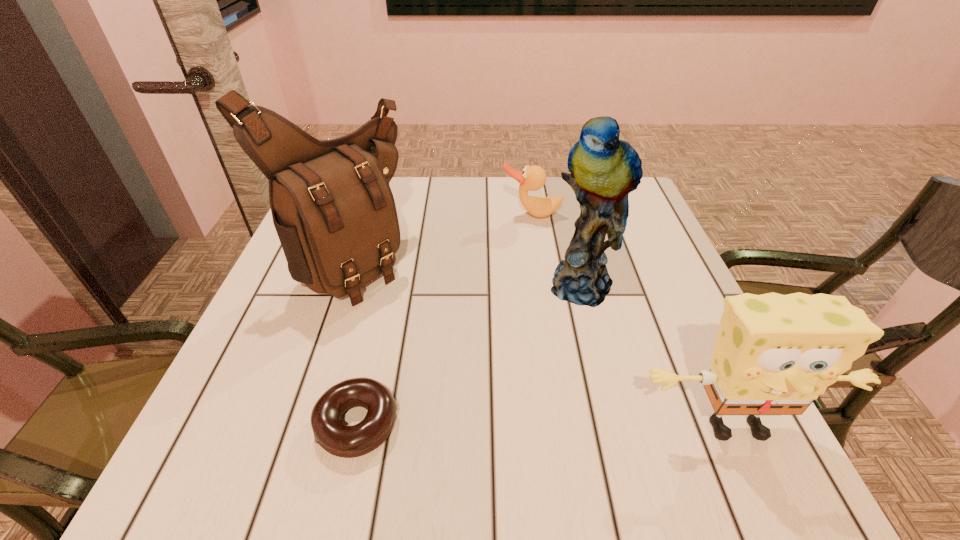
The height and width of the screenshot is (540, 960). I want to click on free spot between the shoulder bag and the shortest object, so click(352, 342).

Locate an element on the screen. This screenshot has width=960, height=540. vacant space that is in between the sponge and the duck is located at coordinates (634, 320).

Locate an element on the screen. Image resolution: width=960 pixels, height=540 pixels. free area in between the shoulder bag and the parrot is located at coordinates pyautogui.click(x=468, y=273).

This screenshot has width=960, height=540. I want to click on free space between the doughnut and the parrot, so click(x=472, y=355).

Find the location of a particular element. Image resolution: width=960 pixels, height=540 pixels. free space between the shoulder bag and the sponge is located at coordinates (541, 343).

Locate an element on the screen. Image resolution: width=960 pixels, height=540 pixels. free spot between the shoulder bag and the third shortest object is located at coordinates (541, 343).

Locate an element on the screen. unoccupied position between the third shortest object and the duck is located at coordinates [x=634, y=320].

You are a GUI agent. You are given a task and a screenshot of the screen. Output one action in this format:
    pyautogui.click(x=<x>, y=<y>)
    Task: Click on the second closest object to the shoulder bag
    This screenshot has height=540, width=960.
    Given the screenshot: What is the action you would take?
    pyautogui.click(x=533, y=178)

Locate an element on the screen. The height and width of the screenshot is (540, 960). object that is the second closest to the shoulder bag is located at coordinates (533, 178).

The height and width of the screenshot is (540, 960). What are the coordinates of `vacant space that satisfies the following two spatial constraints: 1. on the front side of the shoulder bag; 2. on the right side of the shortest object` in the screenshot? It's located at (291, 423).